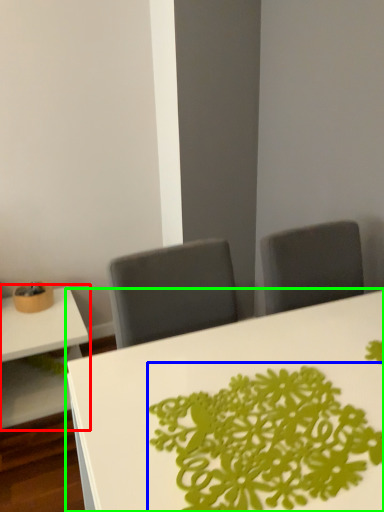
Question: Which object is the farthest from table (highlighted by a red box)? Choose among these: floral arrangement (highlighted by a blue box) or table (highlighted by a green box).

Choices:
 (A) floral arrangement
 (B) table

Answer: (A)